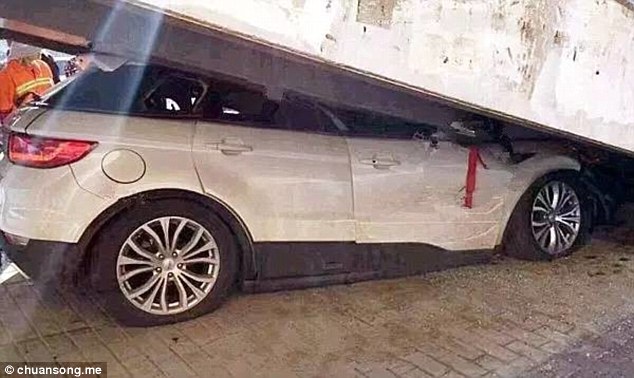
Identify the location of door handles. This screenshot has width=634, height=378. (384, 162), (230, 147).